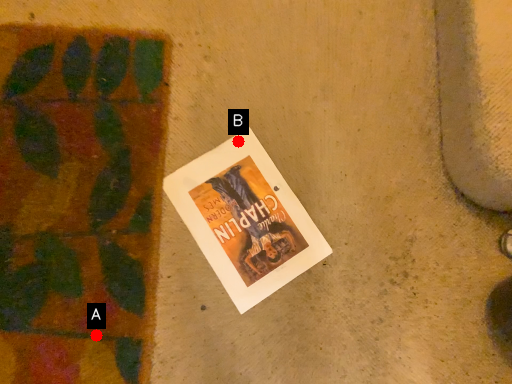
Question: Two points are circled on the image, labeled by A and B beside each circle. Which point is closer to the camera?

Choices:
 (A) A is closer
 (B) B is closer

Answer: (A)